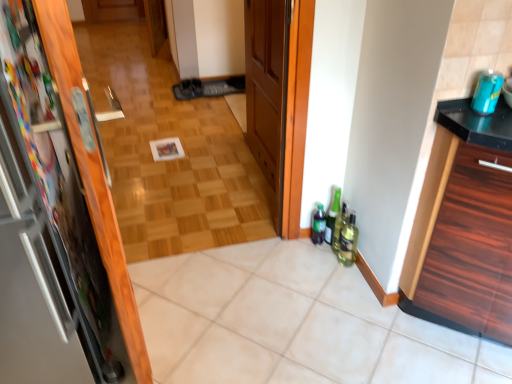
Question: Is black wood cabinet at right facing towards green glass bottle at lower right, positioned as the 3th bottle in left-to-right order?

Choices:
 (A) no
 (B) yes

Answer: (A)

Question: Is black wood cabinet at right next to green glass bottle at lower right, positioned as the 3th bottle in left-to-right order, and touching it?

Choices:
 (A) no
 (B) yes

Answer: (A)

Question: Is black wood cabinet at right at the right side of green glass bottle at lower right, positioned as the 3th bottle in left-to-right order?

Choices:
 (A) yes
 (B) no

Answer: (A)

Question: Is black wood cabinet at right looking in the opposite direction of green glass bottle at lower right, positioned as the 3th bottle in left-to-right order?

Choices:
 (A) yes
 (B) no

Answer: (B)

Question: Is black wood cabinet at right bigger than green glass bottle at lower right, which is the 1th bottle in right-to-left order?

Choices:
 (A) yes
 (B) no

Answer: (A)

Question: In terms of size, does black wood cabinet at right appear bigger or smaller than green glass bottle at lower right, which is the 1th beverage from back to front?

Choices:
 (A) small
 (B) big

Answer: (B)

Question: From a real-world perspective, relative to green glass bottle at lower right, which appears as the 2th beverage when viewed from the front, is black wood cabinet at right vertically above or below?

Choices:
 (A) below
 (B) above

Answer: (B)

Question: Would you say black wood cabinet at right is inside or outside green glass bottle at lower right, acting as the 1th beverage starting from the left?

Choices:
 (A) outside
 (B) inside

Answer: (A)

Question: Would you say black wood cabinet at right is to the left or to the right of green glass bottle at lower right, which is the 1th beverage from back to front, in the picture?

Choices:
 (A) right
 (B) left

Answer: (A)

Question: From a real-world perspective, is wooden parquet floor at center above or below green glass bottle at lower right, which is counted as the 2th beverage, starting from the right?

Choices:
 (A) above
 (B) below

Answer: (A)

Question: Is point (153, 134) closer or farther from the camera than point (336, 254)?

Choices:
 (A) closer
 (B) farther

Answer: (B)

Question: From the image's perspective, is wooden parquet floor at center positioned above or below green glass bottle at lower right, which is the 1th beverage from back to front?

Choices:
 (A) below
 (B) above

Answer: (B)

Question: From their relative heights in the image, would you say wooden parquet floor at center is taller or shorter than green glass bottle at lower right, which is counted as the 2th beverage, starting from the right?

Choices:
 (A) tall
 (B) short

Answer: (A)

Question: From a real-world perspective, is green glass bottle at lower right, positioned as the 3th bottle in left-to-right order, positioned above or below green glass bottle at lower right, positioned as the 2th bottle in left-to-right order?

Choices:
 (A) above
 (B) below

Answer: (A)

Question: From the image's perspective, is green glass bottle at lower right, positioned as the 3th bottle in left-to-right order, positioned above or below green glass bottle at lower right, which is counted as the second bottle, starting from the right?

Choices:
 (A) above
 (B) below

Answer: (B)